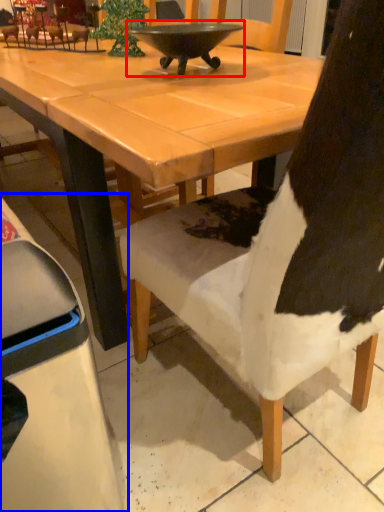
Question: Which object appears closest to the camera in this image, bowl (highlighted by a red box) or chair (highlighted by a blue box)?

Choices:
 (A) bowl
 (B) chair

Answer: (B)